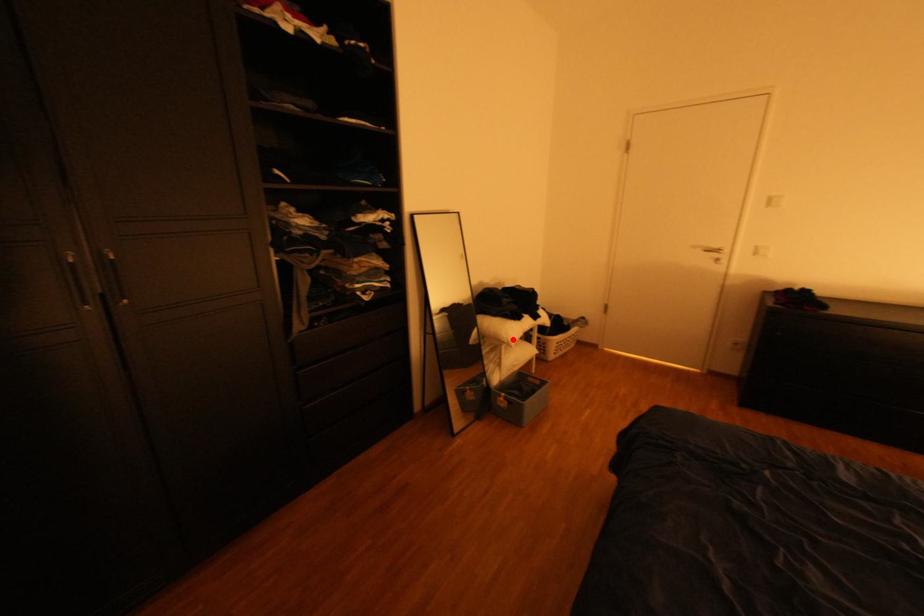
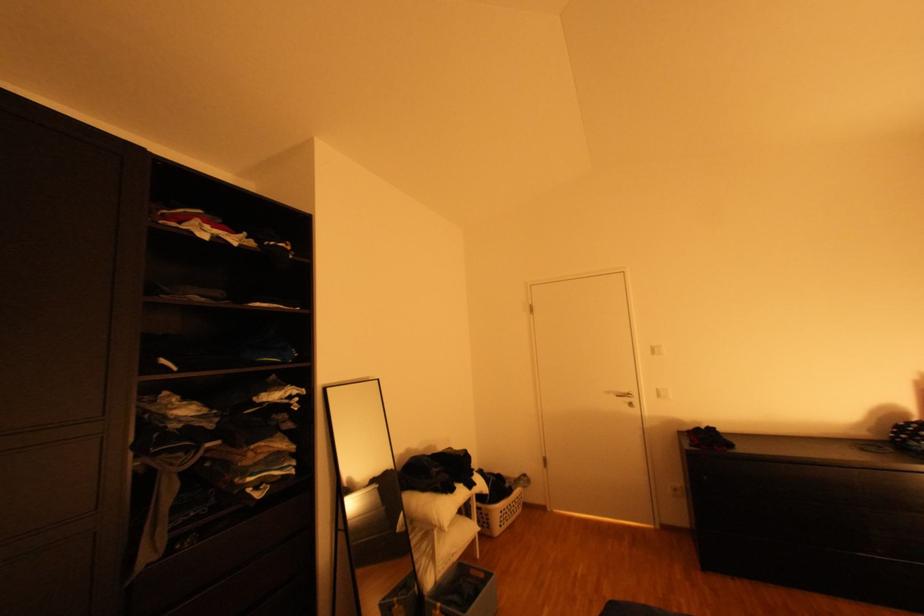
Question: A red point is marked in image1. In image2, is the corresponding 3D point closer to the camera or farther? Reply with the corresponding letter.

Choices:
 (A) The corresponding 3D point is closer.
 (B) The corresponding 3D point is farther.

Answer: (B)